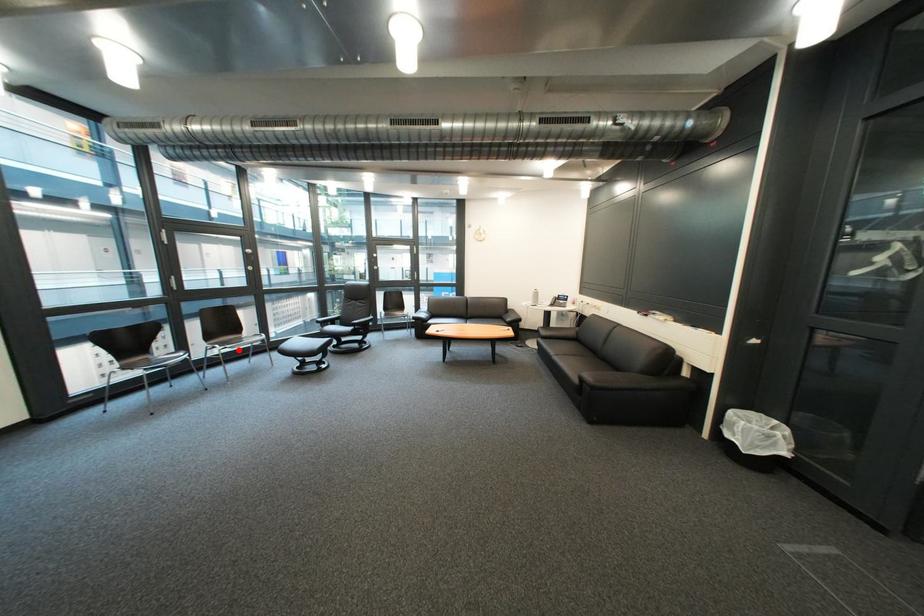
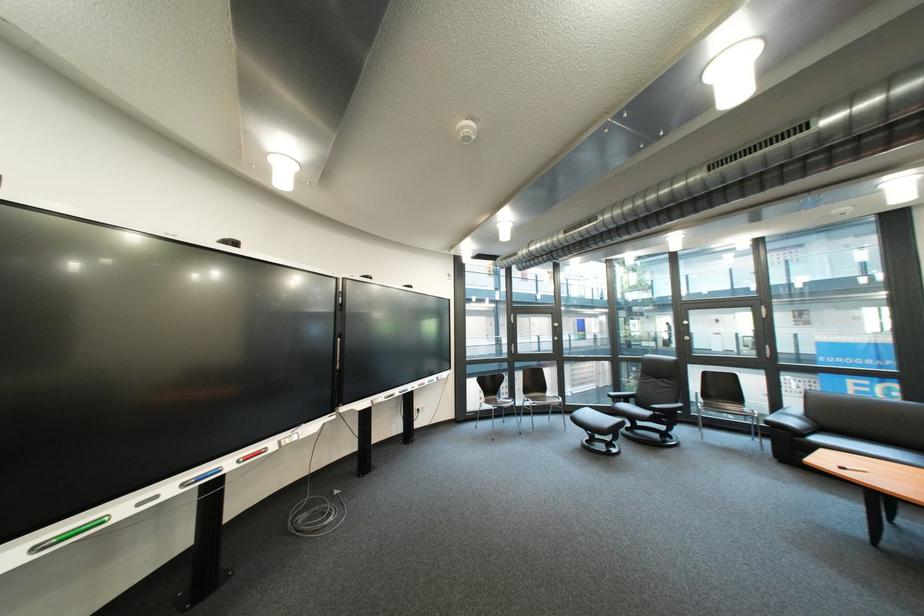
Where in the second image is the point corresponding to the highlighted location from the first image?

(548, 405)